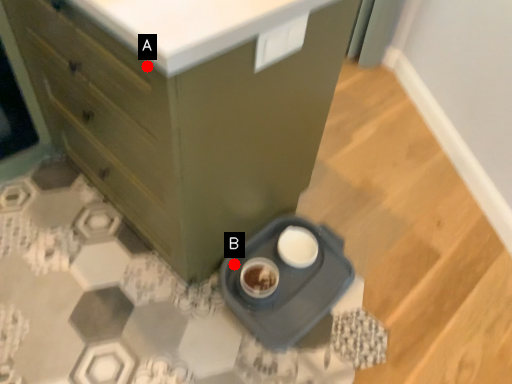
Question: Two points are circled on the image, labeled by A and B beside each circle. Which point is closer to the camera?

Choices:
 (A) A is closer
 (B) B is closer

Answer: (A)